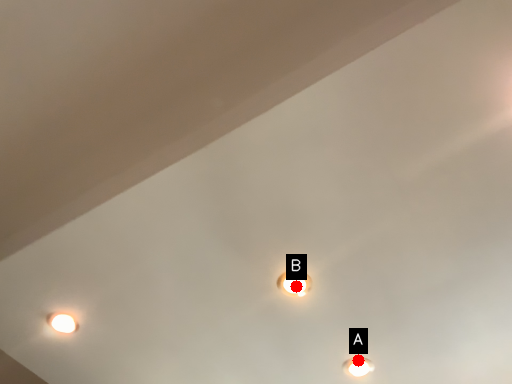
Question: Two points are circled on the image, labeled by A and B beside each circle. Which of the following is the closest to the observer?

Choices:
 (A) A is closer
 (B) B is closer

Answer: (B)